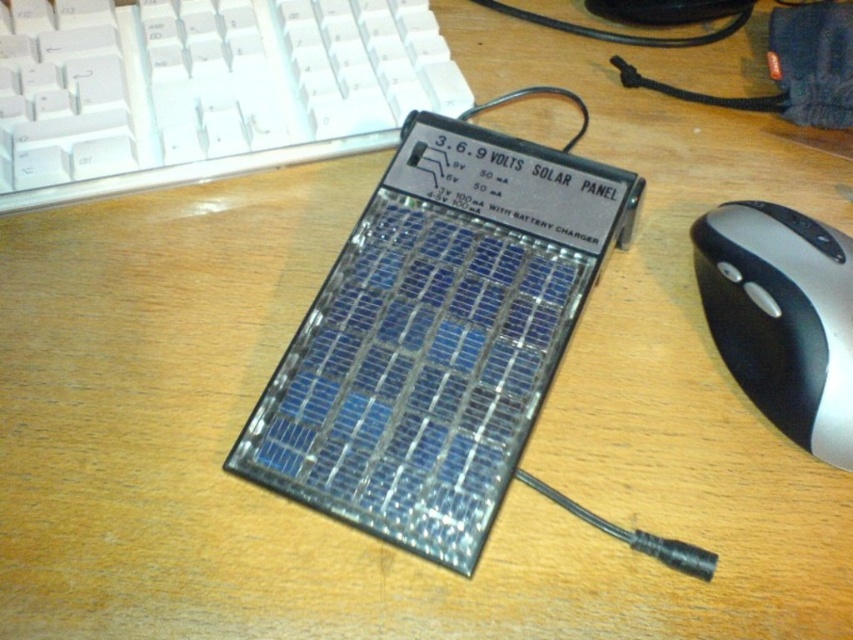
Does white plastic keyboard at upper left have a lesser height compared to silver/black plastic mouse at right?

In fact, white plastic keyboard at upper left may be taller than silver/black plastic mouse at right.

What do you see at coordinates (206, 88) in the screenshot? This screenshot has height=640, width=853. I see `white plastic keyboard at upper left` at bounding box center [206, 88].

Is point (180, 35) less distant than point (822, 326)?

No, it is not.

Identify the location of white plastic keyboard at upper left. (206, 88).